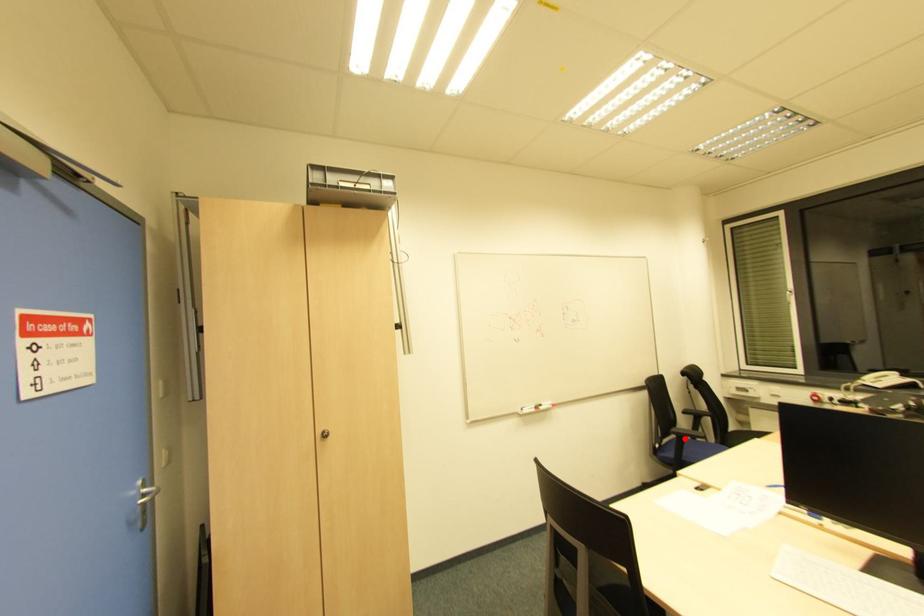
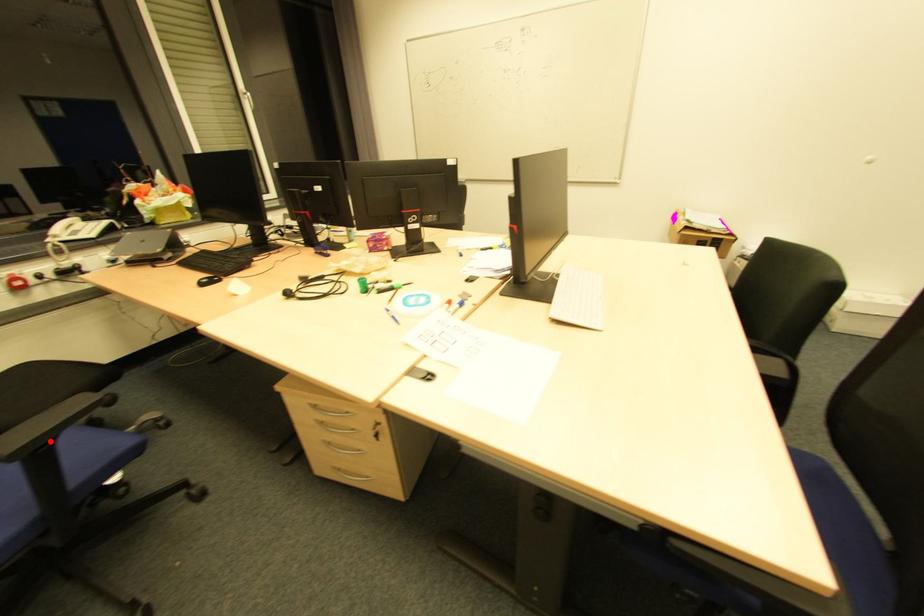
Based on the photo, I am providing you with two images of the same scene from different viewpoints. A red point is marked on the first image and another point is marked on the second image. Is the red point in image1 aligned with the point shown in image2?

Yes